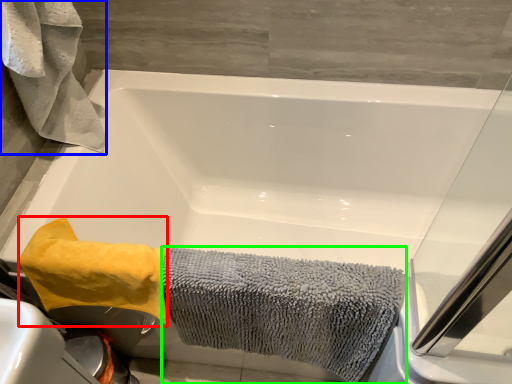
Question: Which object is positioned closest to bath towel (highlighted by a red box)? Select from bath towel (highlighted by a blue box) and bath towel (highlighted by a green box).

Choices:
 (A) bath towel
 (B) bath towel

Answer: (B)